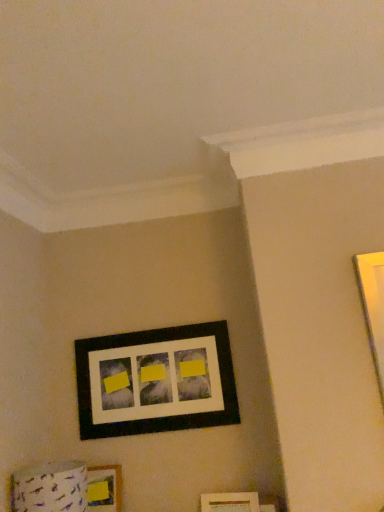
The image size is (384, 512). Describe the element at coordinates (156, 381) in the screenshot. I see `black matte picture frame at center` at that location.

This screenshot has height=512, width=384. Identify the location of black matte picture frame at center. click(156, 381).

This screenshot has height=512, width=384. Find the location of `black matte picture frame at center`. black matte picture frame at center is located at coordinates (156, 381).